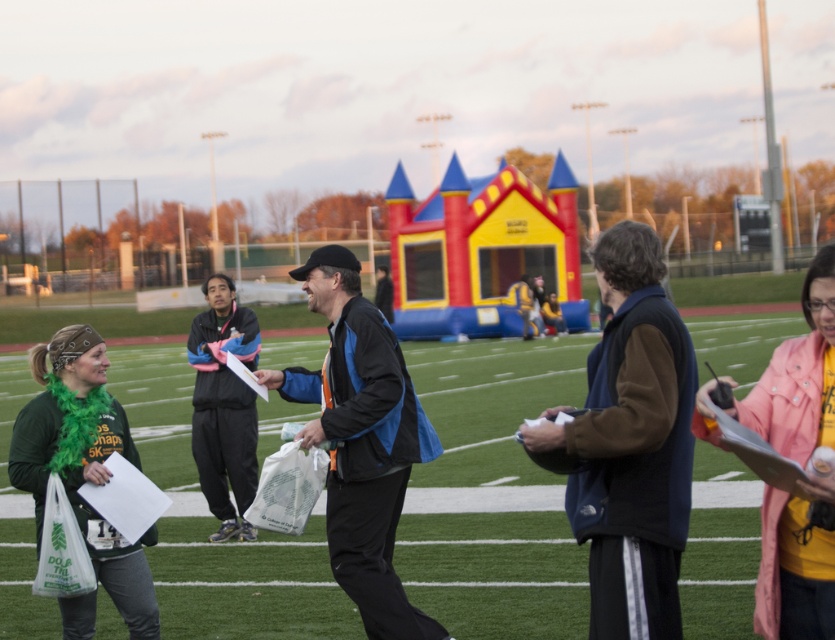
Question: Does green artificial turf at center have a smaller size compared to pink fabric jacket at lower right?

Choices:
 (A) no
 (B) yes

Answer: (A)

Question: Does green artificial turf at center lie in front of pink fabric jacket at lower right?

Choices:
 (A) no
 (B) yes

Answer: (A)

Question: Is green artificial turf at center smaller than pink fabric jacket at lower right?

Choices:
 (A) no
 (B) yes

Answer: (A)

Question: Which of the following is the farthest from the observer?

Choices:
 (A) (798, 458)
 (B) (322, 620)

Answer: (B)